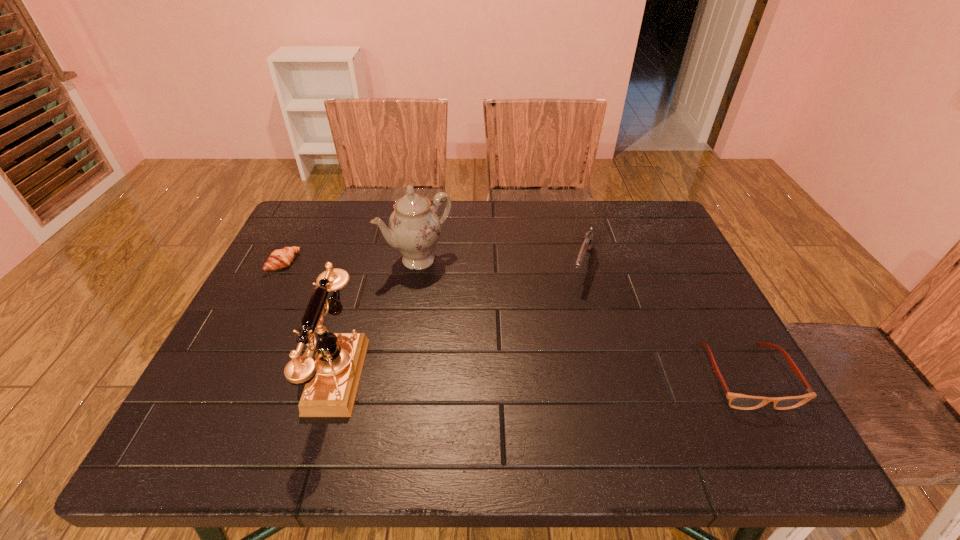
Image resolution: width=960 pixels, height=540 pixels. In order to click on gun located in the far edge section of the desktop in this screenshot , I will do `click(587, 244)`.

Where is `telephone that is at the near edge`? The width and height of the screenshot is (960, 540). telephone that is at the near edge is located at coordinates (331, 379).

This screenshot has width=960, height=540. I want to click on spectacles situated at the near edge, so click(x=737, y=401).

Where is `object positioned at the left edge`? object positioned at the left edge is located at coordinates (280, 258).

Identify the location of object positioned at the right edge. (737, 401).

Where is `object that is at the near right corner`? Image resolution: width=960 pixels, height=540 pixels. object that is at the near right corner is located at coordinates click(737, 401).

Image resolution: width=960 pixels, height=540 pixels. In order to click on vacant space at the far edge of the desktop in this screenshot , I will do `click(470, 244)`.

Identify the location of free space at the near edge of the desktop. The image size is (960, 540). (375, 393).

At what (x,y) coordinates should I click in order to perform the action: click on vacant space at the left edge of the desktop. Please return your answer as a coordinate pair (x, y). Image resolution: width=960 pixels, height=540 pixels. Looking at the image, I should click on (247, 320).

Find the location of `vacant space at the right edge of the desktop`. vacant space at the right edge of the desktop is located at coordinates (710, 364).